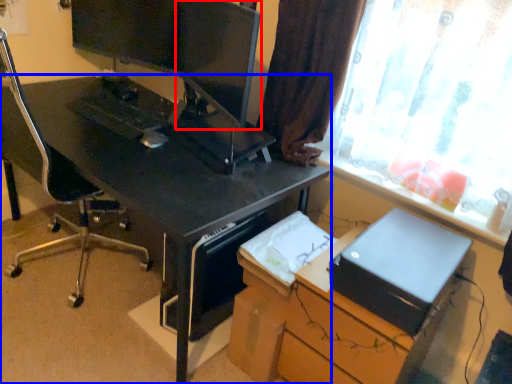
Question: Which point is further to the camera, computer monitor (highlighted by a red box) or desk (highlighted by a blue box)?

Choices:
 (A) computer monitor
 (B) desk

Answer: (A)